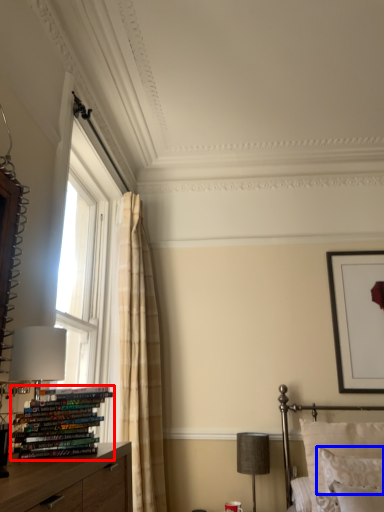
Question: Which of the following is the farthest to the observer, book (highlighted by a red box) or pillow (highlighted by a blue box)?

Choices:
 (A) book
 (B) pillow

Answer: (B)